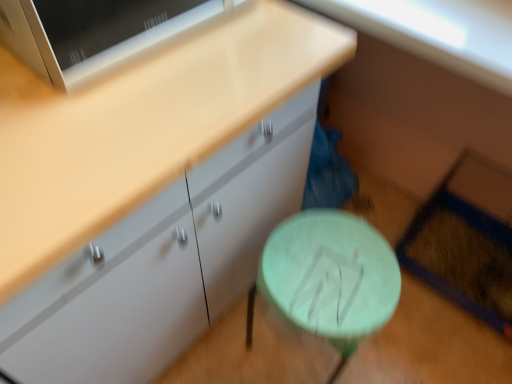
Identify the location of vacant space situated above green matte table at lower center (from a real-world perspective). (333, 266).